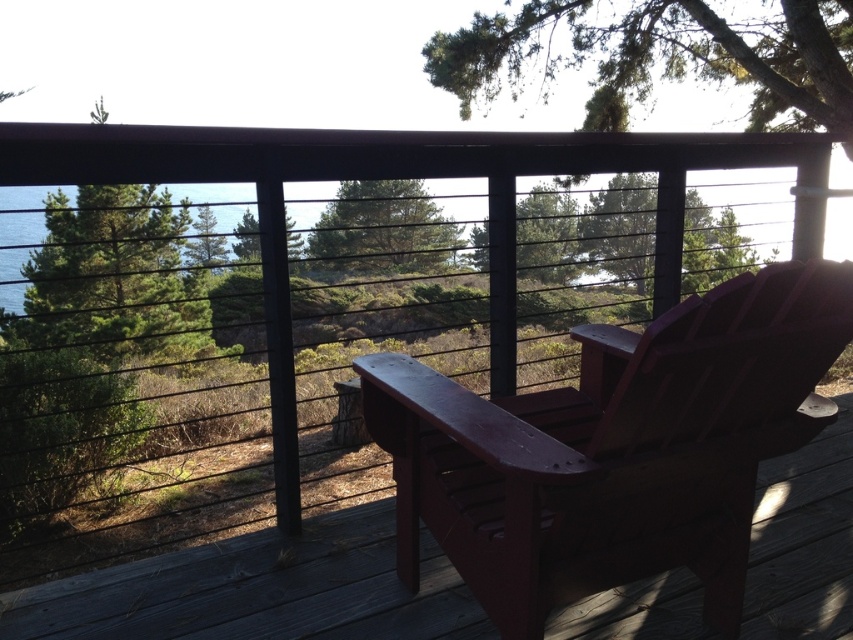
Can you confirm if matte wood rocking chair at center is positioned to the right of green leafy tree at upper center?

Incorrect, matte wood rocking chair at center is not on the right side of green leafy tree at upper center.

Which is above, matte wood rocking chair at center or green leafy tree at upper center?

green leafy tree at upper center is above.

Which is behind, point (711, 465) or point (639, 90)?

Positioned behind is point (639, 90).

The width and height of the screenshot is (853, 640). I want to click on matte wood rocking chair at center, so click(614, 449).

Is the position of green leafy tree at upper center more distant than that of green matte tree at center?

Yes, green leafy tree at upper center is further from the viewer.

Does green leafy tree at upper center appear under green matte tree at center?

No, green leafy tree at upper center is not below green matte tree at center.

Where is `green leafy tree at upper center`? This screenshot has height=640, width=853. green leafy tree at upper center is located at coordinates (662, 52).

Can you confirm if green textured tree at center is positioned to the right of blue water at upper left?

Indeed, green textured tree at center is positioned on the right side of blue water at upper left.

The image size is (853, 640). What do you see at coordinates (381, 228) in the screenshot?
I see `green textured tree at center` at bounding box center [381, 228].

Which is behind, point (366, 212) or point (16, 276)?

Positioned behind is point (366, 212).

Image resolution: width=853 pixels, height=640 pixels. What are the coordinates of `green textured tree at center` in the screenshot? It's located at (381, 228).